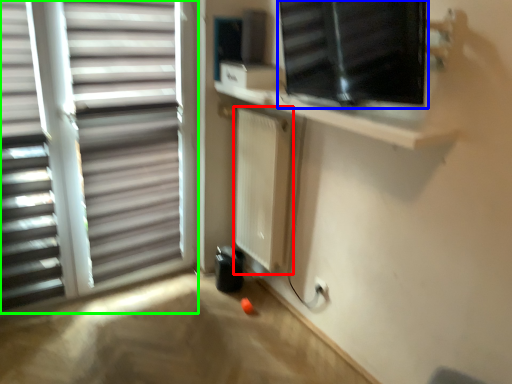
Question: Estimate the real-world distances between objects in this image. Which object is closer to radiator (highlighted by a red box), window (highlighted by a blue box) or window (highlighted by a green box)?

Choices:
 (A) window
 (B) window

Answer: (B)